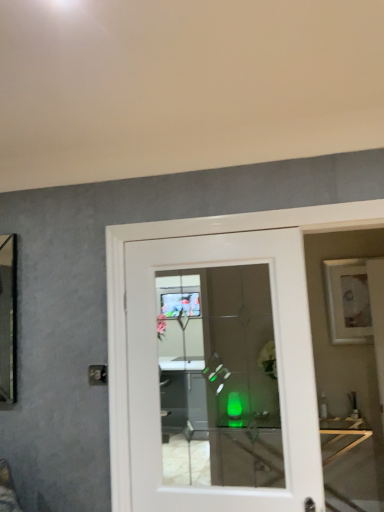
This screenshot has width=384, height=512. I want to click on white glossy door at center, so click(277, 367).

Where is `translucent glass table at center`? This screenshot has width=384, height=512. translucent glass table at center is located at coordinates (342, 436).

Describe the element at coordinates (348, 301) in the screenshot. I see `white matte picture frame at upper right` at that location.

The image size is (384, 512). I want to click on white glossy door at center, so click(277, 367).

Considering the points (342, 437) and (176, 252), which point is behind, point (342, 437) or point (176, 252)?

The point (342, 437) is behind.

From a real-world perspective, is translucent glass table at center located higher than white glossy door at center?

No, from a real-world perspective, translucent glass table at center is not over white glossy door at center

Between translucent glass table at center and white glossy door at center, which one appears on the right side from the viewer's perspective?

translucent glass table at center is more to the right.

Is white matte picture frame at upper right looking in the opposite direction of translucent glass table at center?

white matte picture frame at upper right is not turned away from translucent glass table at center.

The image size is (384, 512). What are the coordinates of `picture frame on the right of the translucent glass table at center` in the screenshot? It's located at (348, 301).

Considering the sizes of white matte picture frame at upper right and translucent glass table at center in the image, is white matte picture frame at upper right taller or shorter than translucent glass table at center?

Clearly, white matte picture frame at upper right is shorter compared to translucent glass table at center.

Is there a large distance between white matte picture frame at upper right and translucent glass table at center?

white matte picture frame at upper right is near translucent glass table at center, not far away.

Based on the photo, considering the sizes of objects white glossy door at center and translucent glass table at center in the image provided, who is taller, white glossy door at center or translucent glass table at center?

With more height is white glossy door at center.

Would you say white glossy door at center is to the left or to the right of translucent glass table at center in the picture?

white glossy door at center is positioned on translucent glass table at center's left side.

Is the surface of white glossy door at center in direct contact with translucent glass table at center?

white glossy door at center and translucent glass table at center are not in contact.

In the scene shown: Is white glossy door at center surrounding white matte picture frame at upper right?

No, white matte picture frame at upper right is not a part of white glossy door at center.

Between white glossy door at center and white matte picture frame at upper right, which one has smaller size?

With smaller size is white matte picture frame at upper right.

Who is shorter, translucent glass table at center or white matte picture frame at upper right?

white matte picture frame at upper right.

From a real-world perspective, is translucent glass table at center physically above white matte picture frame at upper right?

No, from a real-world perspective, translucent glass table at center is not over white matte picture frame at upper right

Based on the photo, is translucent glass table at center closer to camera compared to white matte picture frame at upper right?

Yes, translucent glass table at center is closer to the camera.

Considering the positions of objects translucent glass table at center and white matte picture frame at upper right in the image provided, who is more to the right, translucent glass table at center or white matte picture frame at upper right?

Positioned to the right is white matte picture frame at upper right.

Based on the photo, looking at the image, does white matte picture frame at upper right seem bigger or smaller compared to white glossy door at center?

white matte picture frame at upper right is smaller than white glossy door at center.

Measure the distance between white matte picture frame at upper right and white glossy door at center.

6.51 feet.

Is white matte picture frame at upper right in front of or behind white glossy door at center in the image?

Visually, white matte picture frame at upper right is located behind white glossy door at center.

Between white matte picture frame at upper right and white glossy door at center, which one has less height?

With less height is white matte picture frame at upper right.

Identify the location of table below the white glossy door at center (from the image's perspective). (342, 436).

This screenshot has height=512, width=384. Identify the location of table in front of the white matte picture frame at upper right. (342, 436).

When comparing their distances from white glossy door at center, does translucent glass table at center or white matte picture frame at upper right seem closer?

The object closer to white glossy door at center is translucent glass table at center.

From the image, which object appears to be farther from white matte picture frame at upper right, white glossy door at center or translucent glass table at center?

white glossy door at center is further to white matte picture frame at upper right.

Considering their positions, is white matte picture frame at upper right positioned closer to white glossy door at center than translucent glass table at center?

translucent glass table at center is closer to white glossy door at center.

Considering their positions, is white matte picture frame at upper right positioned closer to translucent glass table at center than white glossy door at center?

white matte picture frame at upper right.

Estimate the real-world distances between objects in this image. Which object is closer to white matte picture frame at upper right, translucent glass table at center or white glossy door at center?

translucent glass table at center is positioned closer to the anchor white matte picture frame at upper right.

Looking at this image, based on their spatial positions, is white glossy door at center or white matte picture frame at upper right closer to translucent glass table at center?

Among the two, white matte picture frame at upper right is located nearer to translucent glass table at center.

Locate an element on the screen. Image resolution: width=384 pixels, height=512 pixels. table between white glossy door at center and white matte picture frame at upper right in the front-back direction is located at coordinates (342, 436).